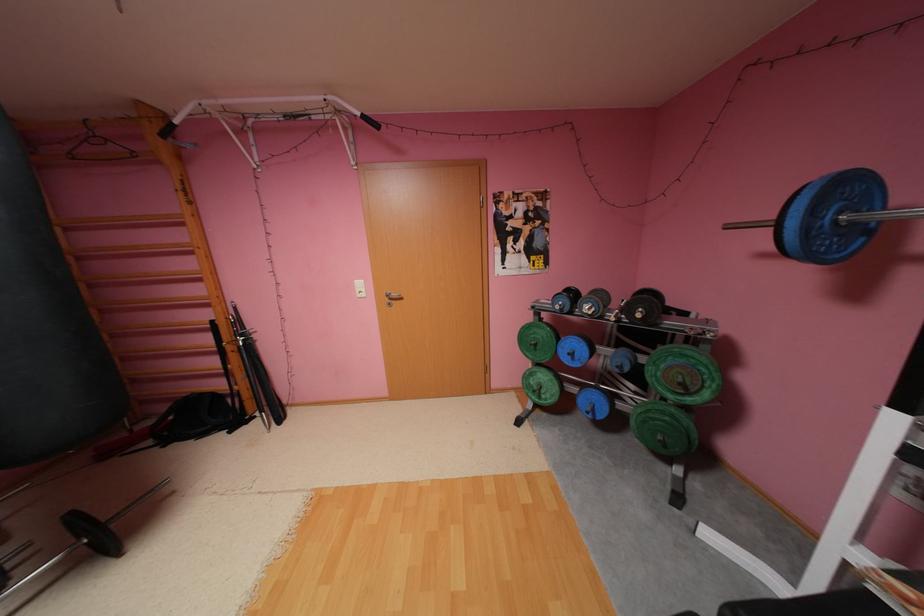
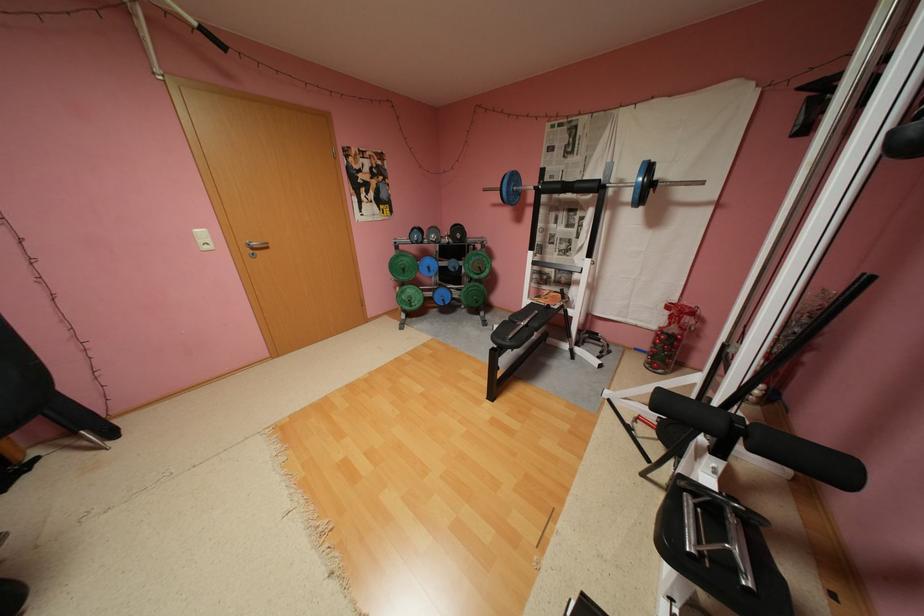
Locate, in the second image, the point that corresponds to point (399, 299) in the first image.

(262, 249)